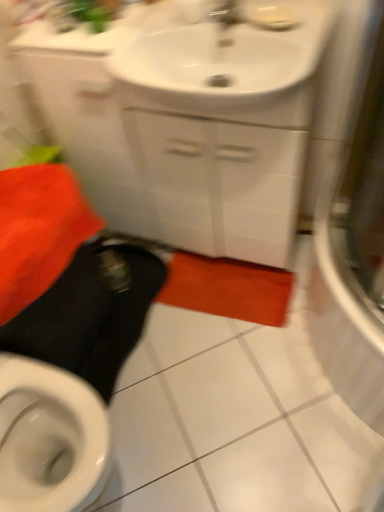
Question: In terms of height, does white glossy cabinet at upper center look taller or shorter compared to white glossy sink at upper center?

Choices:
 (A) short
 (B) tall

Answer: (B)

Question: Is point (155, 196) closer or farther from the camera than point (158, 91)?

Choices:
 (A) closer
 (B) farther

Answer: (B)

Question: Estimate the real-world distances between objects in this image. Which object is farther from the white glossy cabinet at upper center?

Choices:
 (A) white glossy sink at upper center
 (B) black rubber squat at lower left
 (C) transparent glass shower door at right

Answer: (C)

Question: Based on their relative distances, which object is nearer to the black rubber squat at lower left?

Choices:
 (A) white glossy cabinet at upper center
 (B) white glossy sink at upper center
 (C) transparent glass shower door at right

Answer: (A)